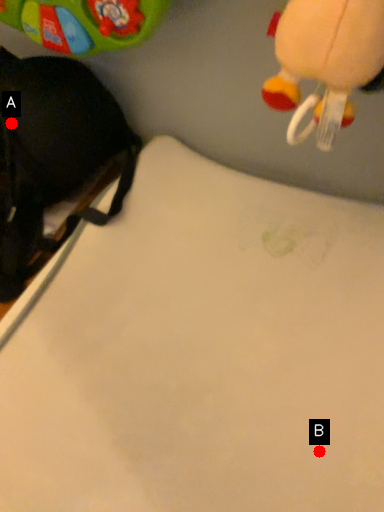
Question: Two points are circled on the image, labeled by A and B beside each circle. Among these points, which one is farthest from the camera?

Choices:
 (A) A is further
 (B) B is further

Answer: (A)